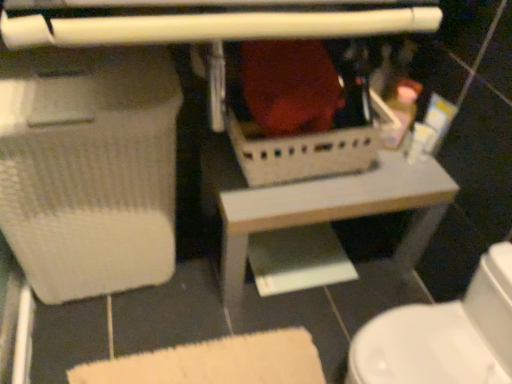
Question: Is white glossy toilet at lower right next to white plastic basket at center and touching it?

Choices:
 (A) yes
 (B) no

Answer: (B)

Question: Can you confirm if white glossy toilet at lower right is thinner than white plastic basket at center?

Choices:
 (A) yes
 (B) no

Answer: (A)

Question: Is white glossy toilet at lower right taller than white plastic basket at center?

Choices:
 (A) no
 (B) yes

Answer: (B)

Question: From the image's perspective, does white glossy toilet at lower right appear lower than white plastic basket at center?

Choices:
 (A) no
 (B) yes

Answer: (B)

Question: Considering the relative positions of white glossy toilet at lower right and white plastic basket at center in the image provided, is white glossy toilet at lower right behind white plastic basket at center?

Choices:
 (A) no
 (B) yes

Answer: (A)

Question: Does white glossy toilet at lower right have a larger size compared to white plastic basket at center?

Choices:
 (A) no
 (B) yes

Answer: (A)

Question: Can you confirm if white plastic basket at center is positioned to the left of white glossy toilet at lower right?

Choices:
 (A) yes
 (B) no

Answer: (A)

Question: Can you confirm if white plastic basket at center is shorter than white glossy toilet at lower right?

Choices:
 (A) yes
 (B) no

Answer: (A)

Question: Does white plastic basket at center have a larger size compared to white glossy toilet at lower right?

Choices:
 (A) no
 (B) yes

Answer: (B)

Question: Is white plastic basket at center wider than white glossy toilet at lower right?

Choices:
 (A) no
 (B) yes

Answer: (B)

Question: From the image's perspective, is white plastic basket at center above white glossy toilet at lower right?

Choices:
 (A) no
 (B) yes

Answer: (B)

Question: From a real-world perspective, is white plastic basket at center over white glossy toilet at lower right?

Choices:
 (A) yes
 (B) no

Answer: (B)

Question: Choose the correct answer: Is white plastic basket at center inside white glossy toilet at lower right or outside it?

Choices:
 (A) outside
 (B) inside

Answer: (A)